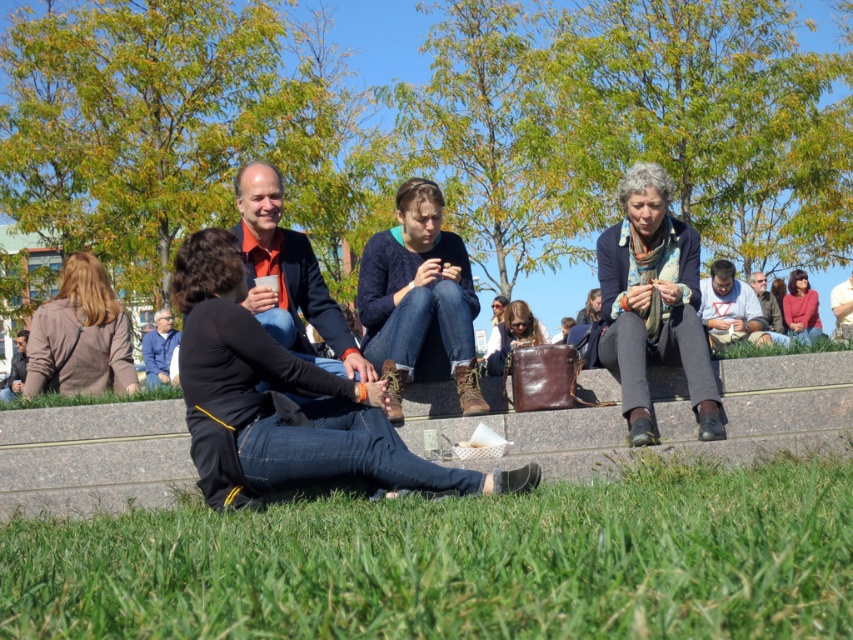
Question: Considering the real-world distances, which object is farthest from the green grass at lower center?

Choices:
 (A) blue denim jeans at center
 (B) matte pink sweater at right

Answer: (B)

Question: Which of these objects is positioned farthest from the matte orange shirt at center?

Choices:
 (A) green grass at lower center
 (B) gray fabric jacket at center
 (C) matte pink sweater at right
 (D) matte brown sweater at lower left

Answer: (B)

Question: Is blue denim jeans at center to the right of matte gray shirt at center from the viewer's perspective?

Choices:
 (A) yes
 (B) no

Answer: (B)

Question: Which point is closer to the camera?

Choices:
 (A) (241, 244)
 (B) (515, 321)
 (C) (448, 474)

Answer: (C)

Question: Can you confirm if matte pink sweater at right is wider than dark gray leather jacket at lower left?

Choices:
 (A) yes
 (B) no

Answer: (A)

Question: Does matte brown sweater at lower left have a greater width compared to matte brown leather bag at center?

Choices:
 (A) yes
 (B) no

Answer: (B)